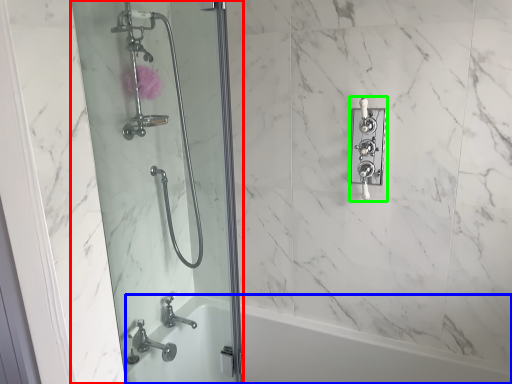
Question: Based on their relative distances, which object is nearer to screen door (highlighted by a red box)? Choose from bath (highlighted by a blue box) and lock (highlighted by a green box).

Choices:
 (A) bath
 (B) lock

Answer: (A)